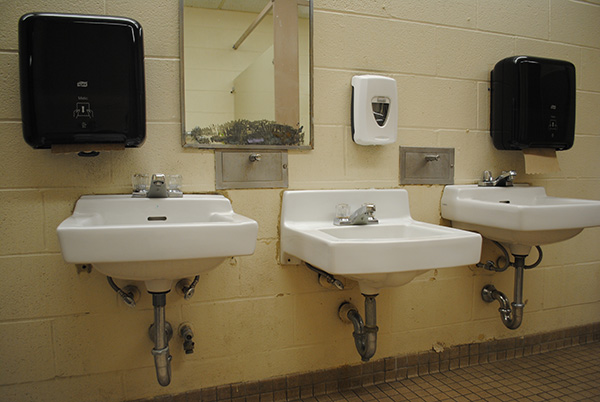
The width and height of the screenshot is (600, 402). In order to click on reflection of light brown pole in mirror in this screenshot , I will do `click(253, 28)`.